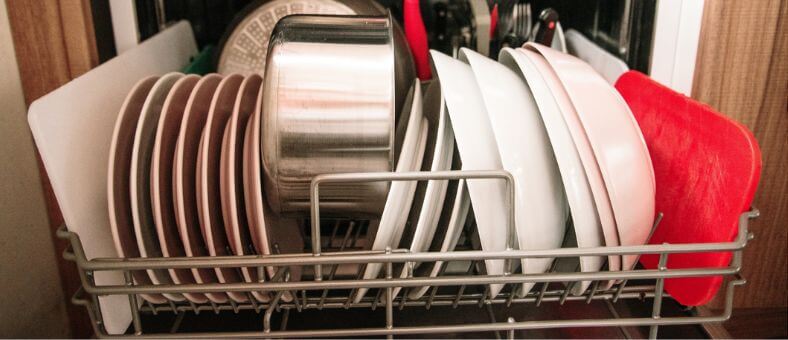
Identify the location of silverware in dishwasher. The width and height of the screenshot is (788, 340). (551, 31), (530, 26), (504, 36), (504, 16), (467, 31), (452, 27), (444, 34), (426, 44).